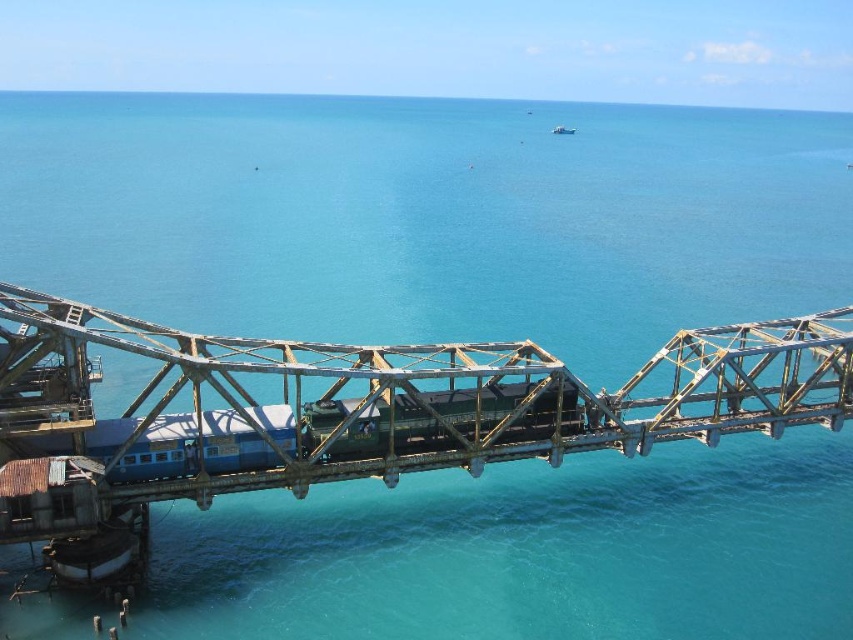
You are a train engineer operating the blue painted steel passenger train at center. You need to cross the rusty metal bridge at center. Can your train safely pass through the bridge?

The rusty metal bridge at center has a width larger than the blue painted steel passenger train at center, so the train can safely pass through the bridge.

From the picture: You are a photographer planning to capture the rusty metal bridge at center and the blue painted steel passenger train at center in a single shot. Based on their sizes, which one will occupy more of the frame?

The rusty metal bridge at center is bigger than the blue painted steel passenger train at center, so it will occupy more of the frame.

You are standing on the railway bridge and want to take a photo of the two points on the bridge structure. Which point, point 1 at coordinates point (288, 416) or point 2 at coordinates point (123, 429), will appear closer to the camera in your photo?

Point 2 at coordinates point (123, 429) will appear closer to the camera in the photo because it is closer to the camera than point 1 at coordinates point (288, 416).